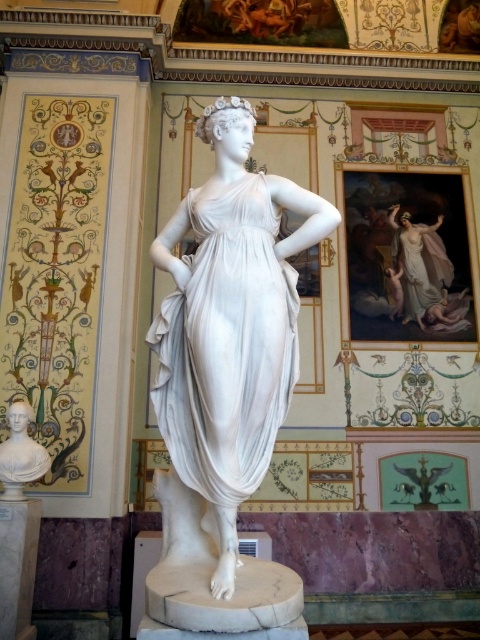
Question: In this image, where is white marble statue at center located relative to matte white bust at lower left?

Choices:
 (A) above
 (B) below

Answer: (A)

Question: Which object appears farthest from the camera in this image?

Choices:
 (A) white marble pillar at lower left
 (B) matte white bust at lower left

Answer: (B)

Question: Can you confirm if white marble statue at center is smaller than matte white bust at lower left?

Choices:
 (A) no
 (B) yes

Answer: (A)

Question: Among these points, which one is nearest to the camera?

Choices:
 (A) (36, 499)
 (B) (1, 474)
 (C) (236, 365)

Answer: (C)

Question: Which point is farther from the camera taking this photo?

Choices:
 (A) (168, 241)
 (B) (19, 522)
 (C) (12, 417)

Answer: (C)

Question: In this image, where is white marble pillar at lower left located relative to matte white bust at lower left?

Choices:
 (A) left
 (B) right

Answer: (B)